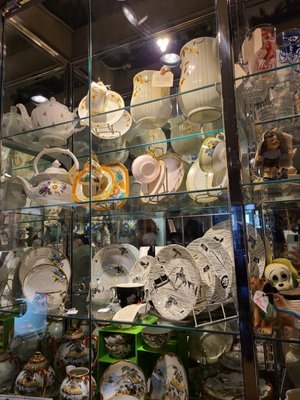
Locate an element on the screen. This screenshot has width=300, height=400. glass shelves is located at coordinates (85, 134), (120, 147), (59, 216), (193, 202), (266, 191), (146, 318), (63, 312).